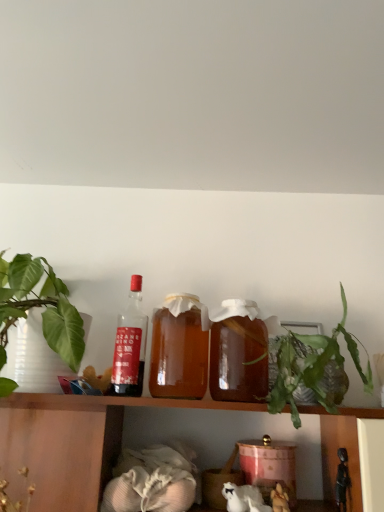
Question: Is translucent glass bottle at center, the 1th bottle positioned from the right, far away from shiny black figurine at lower right, which is the first toy from right to left?

Choices:
 (A) no
 (B) yes

Answer: (A)

Question: From a real-world perspective, is translucent glass bottle at center, positioned as the 3th bottle in left-to-right order, beneath shiny black figurine at lower right, which is the first toy from right to left?

Choices:
 (A) yes
 (B) no

Answer: (B)

Question: Does translucent glass bottle at center, the 1th bottle positioned from the right, appear on the left side of shiny black figurine at lower right, arranged as the 2th toy when viewed from the left?

Choices:
 (A) no
 (B) yes

Answer: (B)

Question: Is translucent glass bottle at center, the 1th bottle positioned from the right, oriented away from shiny black figurine at lower right, arranged as the 2th toy when viewed from the left?

Choices:
 (A) yes
 (B) no

Answer: (B)

Question: Would you say translucent glass bottle at center, the 1th bottle positioned from the right, is outside shiny black figurine at lower right, arranged as the 2th toy when viewed from the left?

Choices:
 (A) no
 (B) yes

Answer: (B)

Question: Is translucent glass bottle at center, which is counted as the 2th bottle, starting from the right, taller or shorter than white fur cat at lower center?

Choices:
 (A) short
 (B) tall

Answer: (B)

Question: Is translucent glass bottle at center, which is counted as the 2th bottle, starting from the right, to the left or to the right of white fur cat at lower center in the image?

Choices:
 (A) left
 (B) right

Answer: (A)

Question: From the image's perspective, is translucent glass bottle at center, acting as the 2th bottle starting from the left, located above or below white fur cat at lower center?

Choices:
 (A) below
 (B) above

Answer: (B)

Question: Relative to white fur cat at lower center, is translucent glass bottle at center, which is counted as the 2th bottle, starting from the right, in front or behind?

Choices:
 (A) behind
 (B) front

Answer: (B)

Question: Is translucent glass bottle at center, the 1th bottle positioned from the right, in front of or behind fluffy white stuffed animal at lower center, acting as the 2th toy starting from the right, in the image?

Choices:
 (A) behind
 (B) front

Answer: (B)

Question: In terms of width, does translucent glass bottle at center, the 1th bottle positioned from the right, look wider or thinner when compared to fluffy white stuffed animal at lower center, the first toy when ordered from left to right?

Choices:
 (A) thin
 (B) wide

Answer: (B)

Question: Based on their sizes in the image, would you say translucent glass bottle at center, positioned as the 3th bottle in left-to-right order, is bigger or smaller than fluffy white stuffed animal at lower center, acting as the 2th toy starting from the right?

Choices:
 (A) small
 (B) big

Answer: (B)

Question: From the image's perspective, is translucent glass bottle at center, the 1th bottle positioned from the right, located above or below fluffy white stuffed animal at lower center, acting as the 2th toy starting from the right?

Choices:
 (A) below
 (B) above

Answer: (B)

Question: Does point (274, 494) appear closer or farther from the camera than point (314, 375)?

Choices:
 (A) closer
 (B) farther

Answer: (B)

Question: Visually, is fluffy white stuffed animal at lower center, acting as the 2th toy starting from the right, positioned to the left or to the right of green leafy plant at right?

Choices:
 (A) right
 (B) left

Answer: (B)